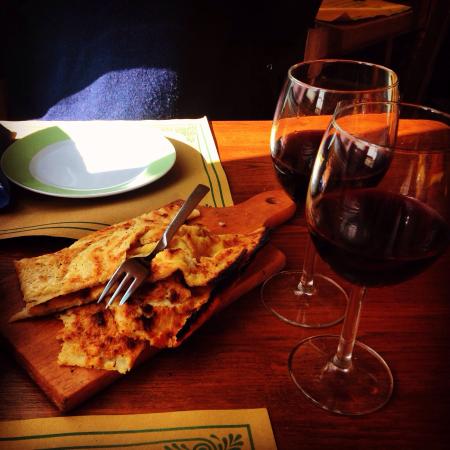
Where is `round bottom of a wine glass`? This screenshot has height=450, width=450. round bottom of a wine glass is located at coordinates (313, 309), (341, 394).